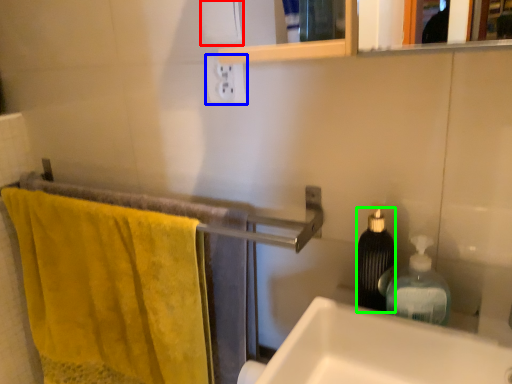
Question: Which is farther away from toilet paper (highlighted by a red box)? electric outlet (highlighted by a blue box) or bottle (highlighted by a green box)?

Choices:
 (A) electric outlet
 (B) bottle

Answer: (B)